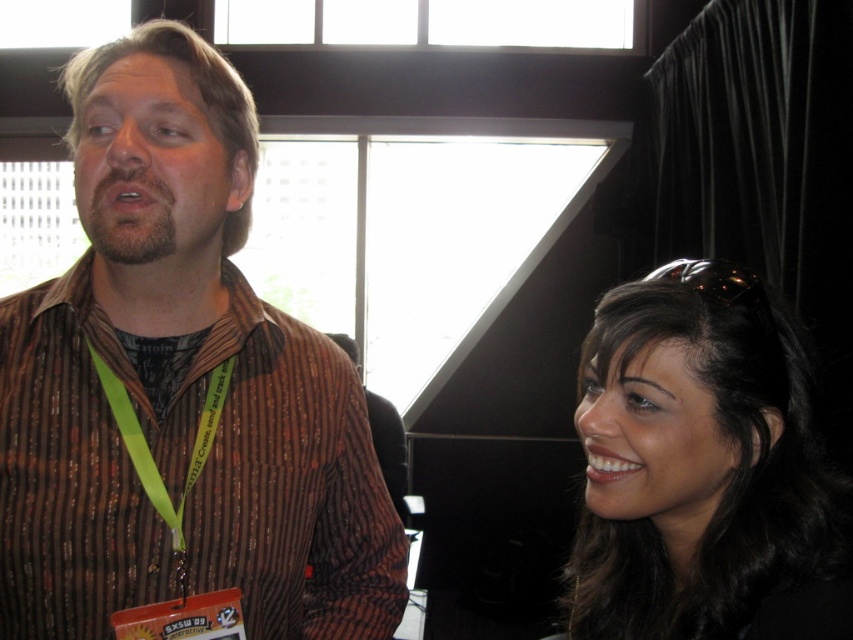
You are standing in a crowded conference hall and see two people in the image. The man on the left has a neon yellow fabric lanyard at left, and the woman on the right has dark brown hair at upper right. Which object is positioned more to the left side of the image?

The neon yellow fabric lanyard at left is positioned more to the left side of the image than the dark brown hair at upper right.

You are holding a 70 cm long measuring tape and want to measure the distance between yourself and the point at coordinates point (187, 193) in the image. Will the measuring tape be sufficient to reach that point?

The distance between you and the point at coordinates point (187, 193) is 79.78 centimeters. Since the measuring tape is only 70 centimeters long, it will not be sufficient to reach the point.

You are a photographer at a conference event. You want to take a photo of the neon yellow fabric lanyard at left without including the viewer in the frame. The camera you are using has a maximum focus range of 70 centimeters. Can you capture the lanyard at left clearly?

The neon yellow fabric lanyard at left and viewer are 72.96 centimeters apart from each other. Since the distance exceeds the camera maximum focus range of 70 centimeters, the photographer cannot capture the lanyard at left clearly without including the viewer.